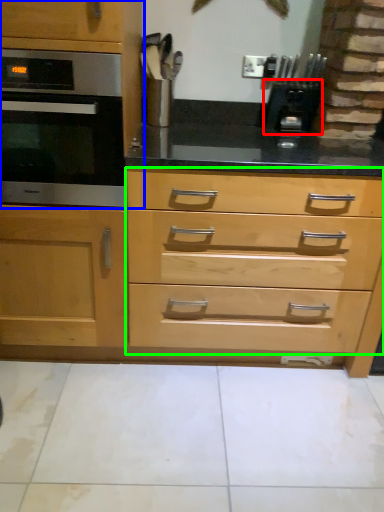
Question: Based on their relative distances, which object is nearer to appliance (highlighted by a red box)? Choose from cabinetry (highlighted by a blue box) and drawer (highlighted by a green box).

Choices:
 (A) cabinetry
 (B) drawer

Answer: (B)